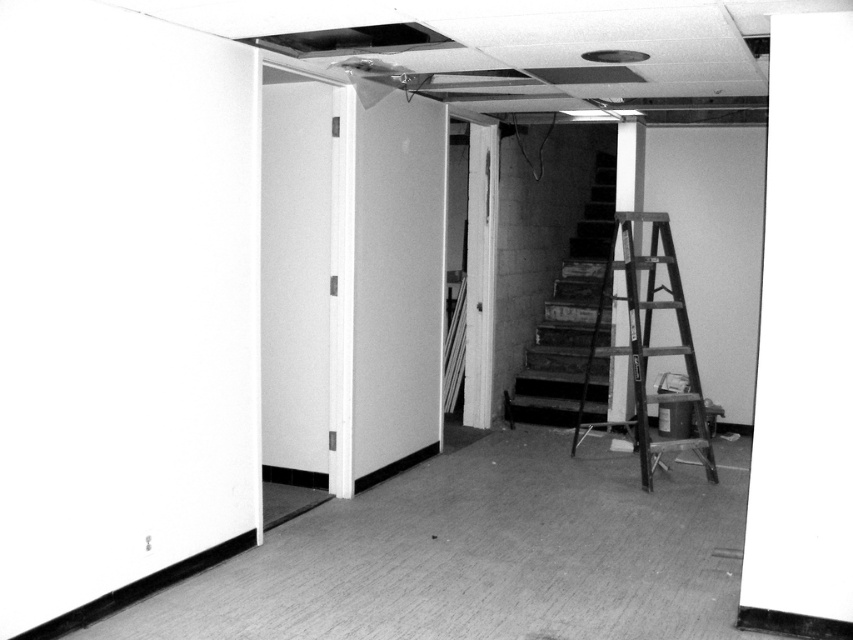
Question: Is the position of smooth carpet at lower center less distant than that of wooden at right?

Choices:
 (A) yes
 (B) no

Answer: (A)

Question: Which of the following is the closest to the observer?

Choices:
 (A) smooth carpet at lower center
 (B) smooth white pillar at center

Answer: (A)

Question: Observing the image, what is the correct spatial positioning of smooth carpet at lower center in reference to smooth white pillar at center?

Choices:
 (A) below
 (B) above

Answer: (A)

Question: Which object is the farthest from the smooth carpet at lower center?

Choices:
 (A) smooth white pillar at center
 (B) wooden at right

Answer: (A)

Question: Does wooden at right come behind smooth white pillar at center?

Choices:
 (A) no
 (B) yes

Answer: (A)

Question: Which point is farther to the camera?

Choices:
 (A) (664, 440)
 (B) (292, 518)
 (C) (614, 166)

Answer: (C)